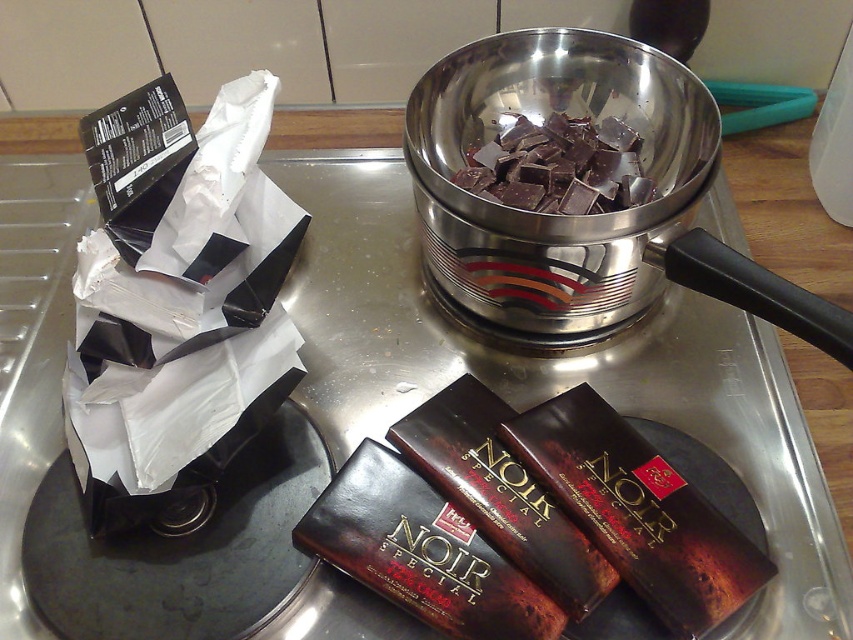
Based on the photo, does shiny dark brown chocolate bar at lower center appear under dark chocolate chunks at center?

Correct, shiny dark brown chocolate bar at lower center is located below dark chocolate chunks at center.

You are a GUI agent. You are given a task and a screenshot of the screen. Output one action in this format:
    pyautogui.click(x=<x>, y=<y>)
    Task: Click on the shiny dark brown chocolate bar at lower center
    Image resolution: width=853 pixels, height=640 pixels.
    Given the screenshot: What is the action you would take?
    pyautogui.click(x=421, y=552)

Identify the location of shiny dark brown chocolate bar at lower center. The width and height of the screenshot is (853, 640). (421, 552).

Between shiny metallic bowl at center and shiny dark brown chocolate bar at lower center, which one appears on the right side from the viewer's perspective?

shiny metallic bowl at center

Is point (422, 170) positioned after point (392, 557)?

That is True.

The height and width of the screenshot is (640, 853). I want to click on shiny metallic bowl at center, so click(555, 212).

Where is `shiny metallic bowl at center`? shiny metallic bowl at center is located at coordinates (555, 212).

Which is behind, point (405, 413) or point (575, 132)?

The point (575, 132) is more distant.

Is point (573, 614) less distant than point (555, 211)?

Yes.

Find the location of a particular element. The height and width of the screenshot is (640, 853). dark brown glossy chocolate bar at lower center is located at coordinates (502, 493).

Where is `dark brown glossy chocolate bar at lower center`? The height and width of the screenshot is (640, 853). dark brown glossy chocolate bar at lower center is located at coordinates (502, 493).